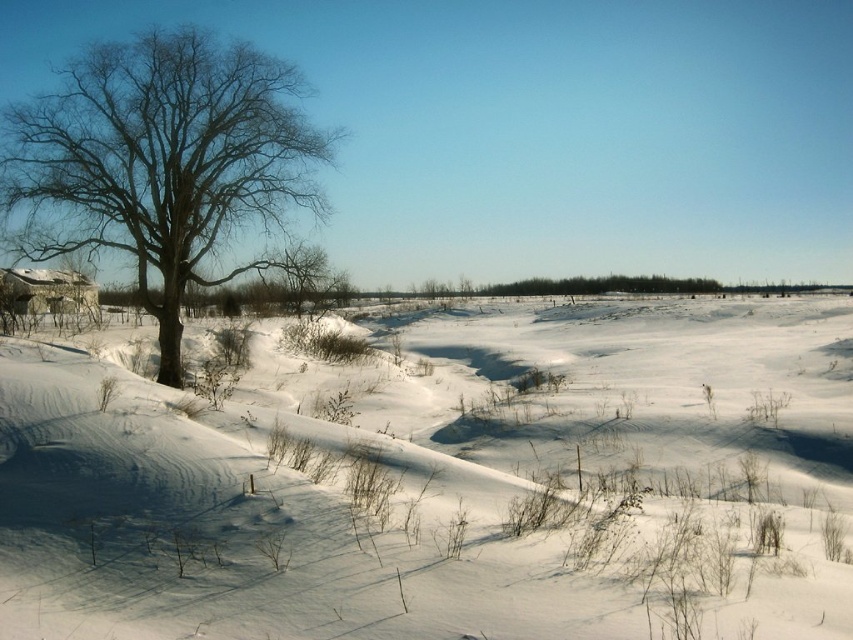
Question: In this image, where is bare branches at left located relative to gray stone hut at left?

Choices:
 (A) left
 (B) right

Answer: (B)

Question: Which point appears farthest from the camera in this image?

Choices:
 (A) (4, 152)
 (B) (811, 598)

Answer: (A)

Question: Among these objects, which one is nearest to the camera?

Choices:
 (A) white fluffy snow at center
 (B) bare branches at left

Answer: (A)

Question: Where is bare branches at left located in relation to gray stone hut at left in the image?

Choices:
 (A) below
 (B) above

Answer: (B)

Question: Which point is farther from the camera taking this photo?

Choices:
 (A) (184, 250)
 (B) (85, 508)

Answer: (A)

Question: Is the position of bare branches at left less distant than that of gray stone hut at left?

Choices:
 (A) yes
 (B) no

Answer: (A)